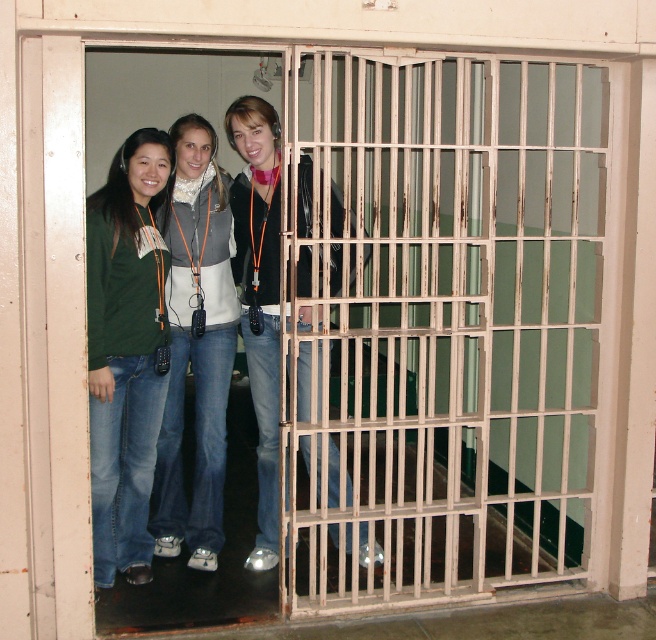
You are standing in front of the prison cell door in the image. There is a point marked at coordinates [445,323]. What object does this point correspond to?

The point at coordinates [445,323] corresponds to the rusty metal bars at center.

You are a tour guide who needs to direct a visitor to the person wearing denim jeans at center and matte black jacket at center. Since both are standing in the same area, can you tell the visitor which one is on the left side?

The denim jeans at center is positioned on the left side of matte black jacket at center, so the person wearing denim jeans at center is on the left side.